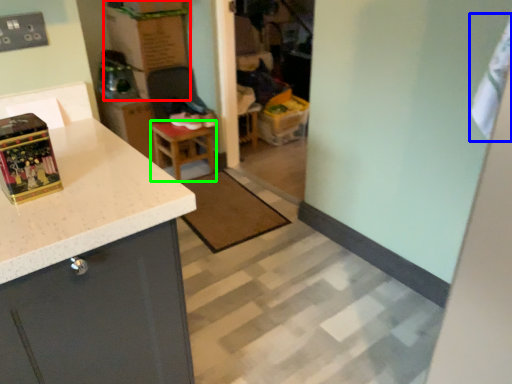
Question: Based on their relative distances, which object is nearer to cardboard box (highlighted by a red box)? Choose from laundry (highlighted by a blue box) and table (highlighted by a green box).

Choices:
 (A) laundry
 (B) table

Answer: (B)